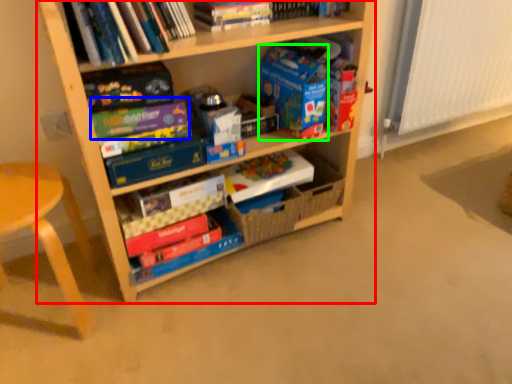
Question: Based on their relative distances, which object is farther from shelf (highlighted by a red box)? Choose from paperback book (highlighted by a blue box) and paperback book (highlighted by a green box).

Choices:
 (A) paperback book
 (B) paperback book

Answer: (A)